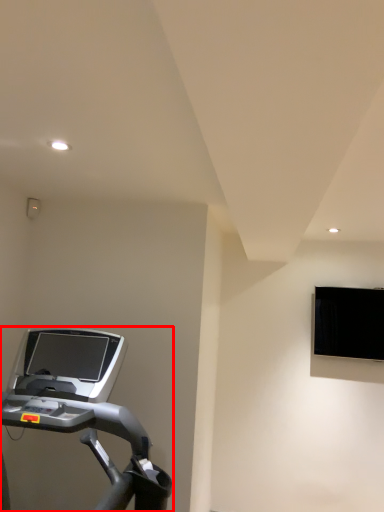
Question: From the image's perspective, what is the correct spatial relationship of treadmill (annotated by the red box) in relation to computer monitor?

Choices:
 (A) above
 (B) below

Answer: (B)